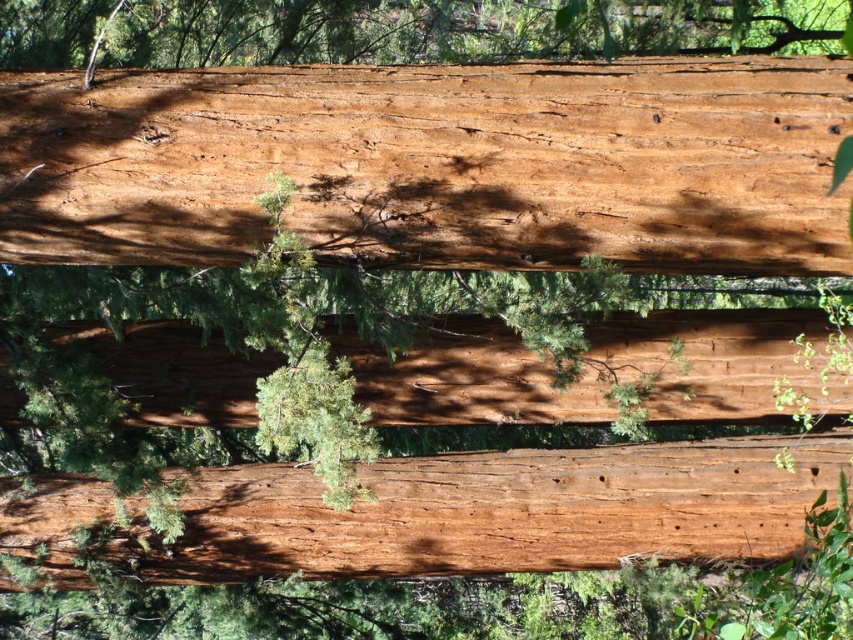
Question: Can you confirm if smooth reddish-brown wood at center is thinner than smooth reddish-brown log at center?

Choices:
 (A) yes
 (B) no

Answer: (A)

Question: Is smooth reddish-brown wood at center to the right of smooth reddish-brown log at center from the viewer's perspective?

Choices:
 (A) yes
 (B) no

Answer: (A)

Question: Which of the following is the closest to the observer?

Choices:
 (A) (102, 112)
 (B) (653, 524)

Answer: (A)

Question: Which point appears farthest from the camera in this image?

Choices:
 (A) (138, 506)
 (B) (386, 221)

Answer: (A)

Question: Can you confirm if smooth reddish-brown wood at center is positioned to the right of smooth reddish-brown log at center?

Choices:
 (A) no
 (B) yes

Answer: (B)